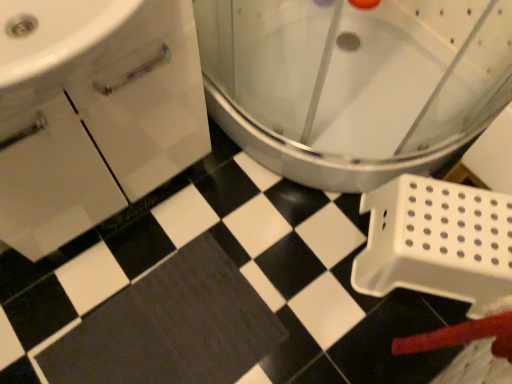
Question: Based on their positions, is white plastic toilet at center located to the left or right of black matte bath mat at center?

Choices:
 (A) right
 (B) left

Answer: (A)

Question: Relative to black matte bath mat at center, is white plastic toilet at center in front or behind?

Choices:
 (A) behind
 (B) front

Answer: (B)

Question: Based on their sizes in the image, would you say white plastic toilet at center is bigger or smaller than black matte bath mat at center?

Choices:
 (A) small
 (B) big

Answer: (B)

Question: Is black matte bath mat at center situated inside white plastic toilet at center or outside?

Choices:
 (A) outside
 (B) inside

Answer: (A)

Question: Relative to white plastic toilet at center, is black matte bath mat at center in front or behind?

Choices:
 (A) behind
 (B) front

Answer: (A)

Question: From the image's perspective, is black matte bath mat at center above or below white plastic toilet at center?

Choices:
 (A) above
 (B) below

Answer: (B)

Question: Based on their sizes in the image, would you say black matte bath mat at center is bigger or smaller than white plastic toilet at center?

Choices:
 (A) small
 (B) big

Answer: (A)